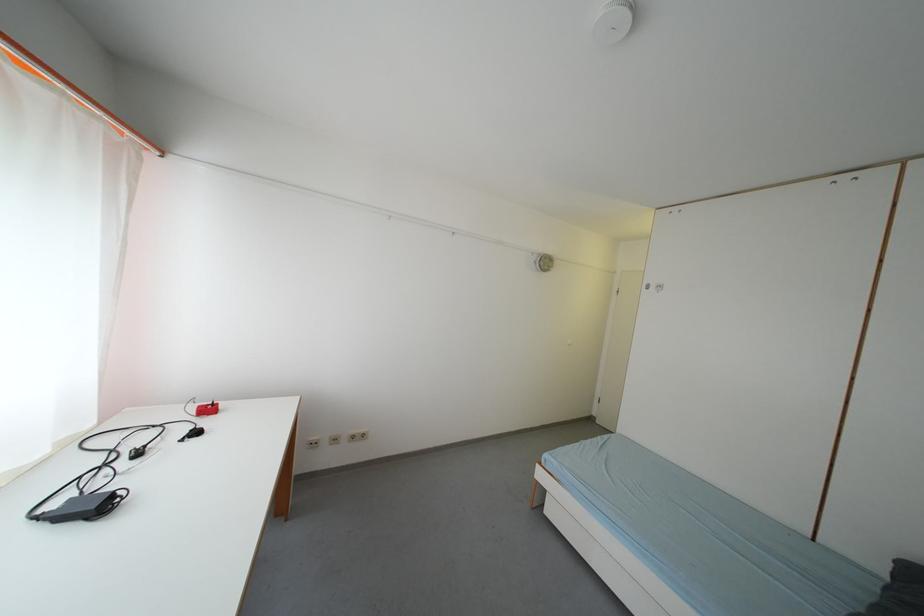
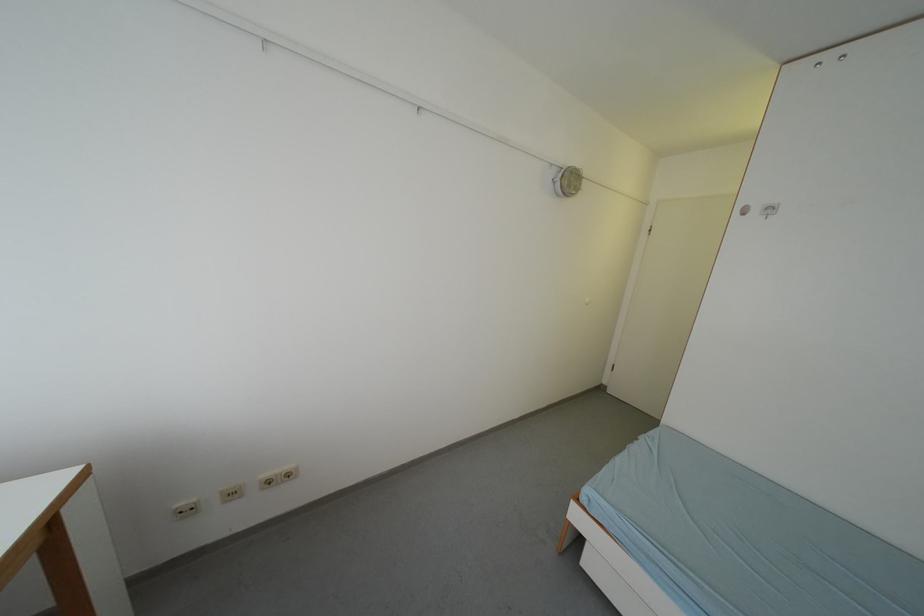
Question: What movement of the cameraman would produce the second image?

Choices:
 (A) Left
 (B) Right
 (C) Forward
 (D) Backward

Answer: (C)